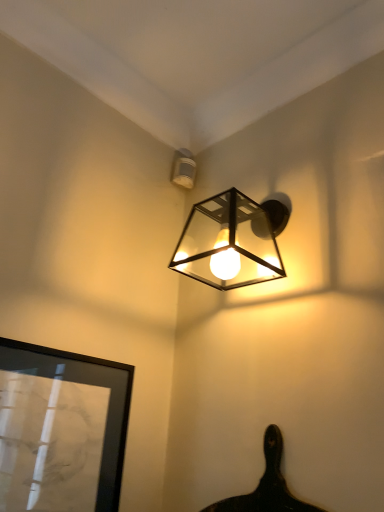
Question: Does white plastic sensor at upper center, the second lamp when ordered from bottom to top, lie in front of black glossy picture frame at lower left?

Choices:
 (A) yes
 (B) no

Answer: (B)

Question: Does white plastic sensor at upper center, the second lamp when ordered from bottom to top, have a greater height compared to black glossy picture frame at lower left?

Choices:
 (A) no
 (B) yes

Answer: (A)

Question: Is white plastic sensor at upper center, acting as the 1th lamp starting from the top, behind black glossy picture frame at lower left?

Choices:
 (A) no
 (B) yes

Answer: (B)

Question: Does white plastic sensor at upper center, the 1th lamp when ordered from back to front, appear on the right side of black glossy picture frame at lower left?

Choices:
 (A) no
 (B) yes

Answer: (B)

Question: Is white plastic sensor at upper center, the second lamp when ordered from bottom to top, not close to black glossy picture frame at lower left?

Choices:
 (A) yes
 (B) no

Answer: (B)

Question: From the image's perspective, would you say white plastic sensor at upper center, which is the second lamp in front-to-back order, is positioned over black glossy picture frame at lower left?

Choices:
 (A) no
 (B) yes

Answer: (B)

Question: From a real-world perspective, is black glossy picture frame at lower left on white plastic sensor at upper center, the second lamp when ordered from bottom to top?

Choices:
 (A) yes
 (B) no

Answer: (B)

Question: Can you confirm if black glossy picture frame at lower left is bigger than white plastic sensor at upper center, the second lamp when ordered from bottom to top?

Choices:
 (A) yes
 (B) no

Answer: (A)

Question: Can you confirm if black glossy picture frame at lower left is taller than white plastic sensor at upper center, the 1th lamp when ordered from back to front?

Choices:
 (A) yes
 (B) no

Answer: (A)

Question: Is black glossy picture frame at lower left surrounding white plastic sensor at upper center, the second lamp when ordered from bottom to top?

Choices:
 (A) no
 (B) yes

Answer: (A)

Question: From the image's perspective, does black glossy picture frame at lower left appear higher than white plastic sensor at upper center, the 1th lamp when ordered from back to front?

Choices:
 (A) yes
 (B) no

Answer: (B)

Question: Is black glossy picture frame at lower left aimed at white plastic sensor at upper center, which is the second lamp in front-to-back order?

Choices:
 (A) yes
 (B) no

Answer: (B)

Question: Is metallic cube-shaped light fixture at upper center, acting as the 1th lamp starting from the front, located outside black glossy picture frame at lower left?

Choices:
 (A) no
 (B) yes

Answer: (B)